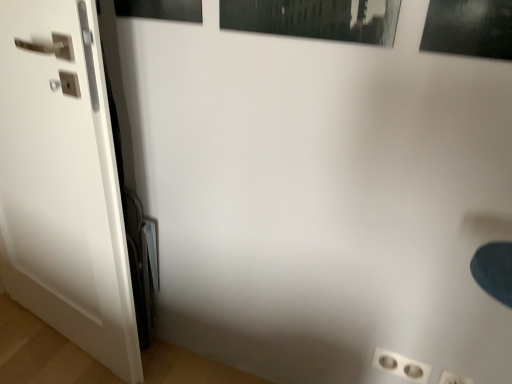
Question: Is white plastic outlet at lower right not inside matte black picture frame at upper left?

Choices:
 (A) no
 (B) yes

Answer: (B)

Question: Is the depth of white plastic outlet at lower right less than that of matte black picture frame at upper left?

Choices:
 (A) yes
 (B) no

Answer: (B)

Question: Could you tell me if white plastic outlet at lower right is facing matte black picture frame at upper left?

Choices:
 (A) no
 (B) yes

Answer: (A)

Question: Considering the relative sizes of white plastic outlet at lower right and matte black picture frame at upper left in the image provided, is white plastic outlet at lower right shorter than matte black picture frame at upper left?

Choices:
 (A) no
 (B) yes

Answer: (B)

Question: Is white plastic outlet at lower right positioned with its back to matte black picture frame at upper left?

Choices:
 (A) no
 (B) yes

Answer: (A)

Question: Looking at their shapes, would you say white plastic outlet at lower right is wider or thinner than matte black picture frame at upper left?

Choices:
 (A) wide
 (B) thin

Answer: (B)

Question: In terms of size, does white plastic outlet at lower right appear bigger or smaller than matte black picture frame at upper left?

Choices:
 (A) small
 (B) big

Answer: (A)

Question: From a real-world perspective, is white plastic outlet at lower right physically located above or below matte black picture frame at upper left?

Choices:
 (A) below
 (B) above

Answer: (A)

Question: Which is correct: white plastic outlet at lower right is inside matte black picture frame at upper left, or outside of it?

Choices:
 (A) inside
 (B) outside

Answer: (B)

Question: Looking at the image, does white plastic outlet at lower right seem bigger or smaller compared to white glossy door at left?

Choices:
 (A) big
 (B) small

Answer: (B)

Question: In the image, is white plastic outlet at lower right on the left side or the right side of white glossy door at left?

Choices:
 (A) left
 (B) right

Answer: (B)

Question: Choose the correct answer: Is white plastic outlet at lower right inside white glossy door at left or outside it?

Choices:
 (A) outside
 (B) inside

Answer: (A)

Question: From a real-world perspective, is white plastic outlet at lower right physically located above or below white glossy door at left?

Choices:
 (A) above
 (B) below

Answer: (B)

Question: Considering the positions of point (183, 1) and point (375, 354), is point (183, 1) closer or farther from the camera than point (375, 354)?

Choices:
 (A) closer
 (B) farther

Answer: (A)

Question: Considering the positions of matte black picture frame at upper left and white plastic outlet at lower right in the image, is matte black picture frame at upper left wider or thinner than white plastic outlet at lower right?

Choices:
 (A) thin
 (B) wide

Answer: (B)